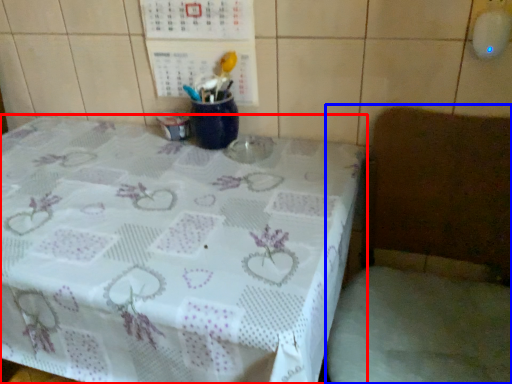
Question: Which object appears farthest to the camera in this image, table (highlighted by a red box) or chair (highlighted by a blue box)?

Choices:
 (A) table
 (B) chair

Answer: (A)